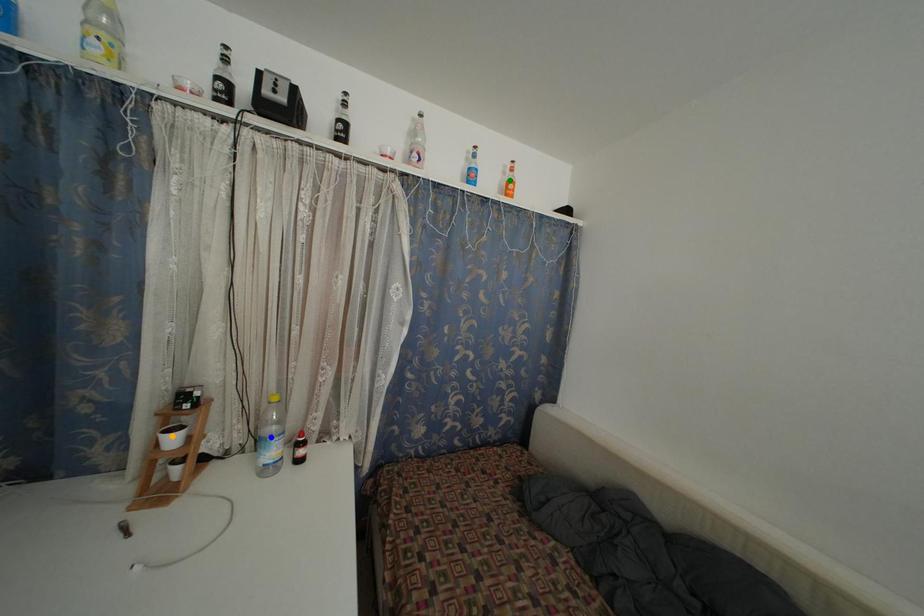
Order these from nearest to farthest:
- orange point
- green point
- blue point

green point, blue point, orange point